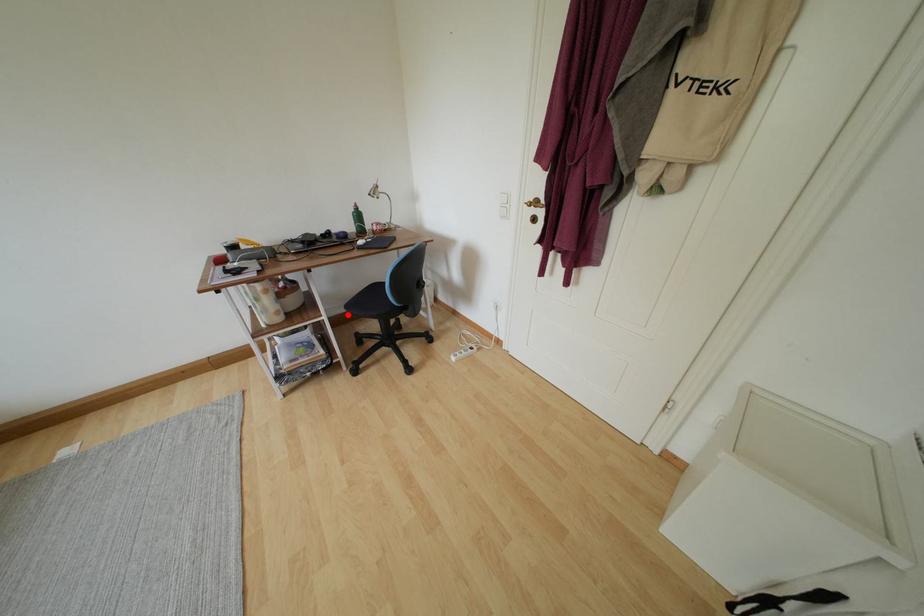
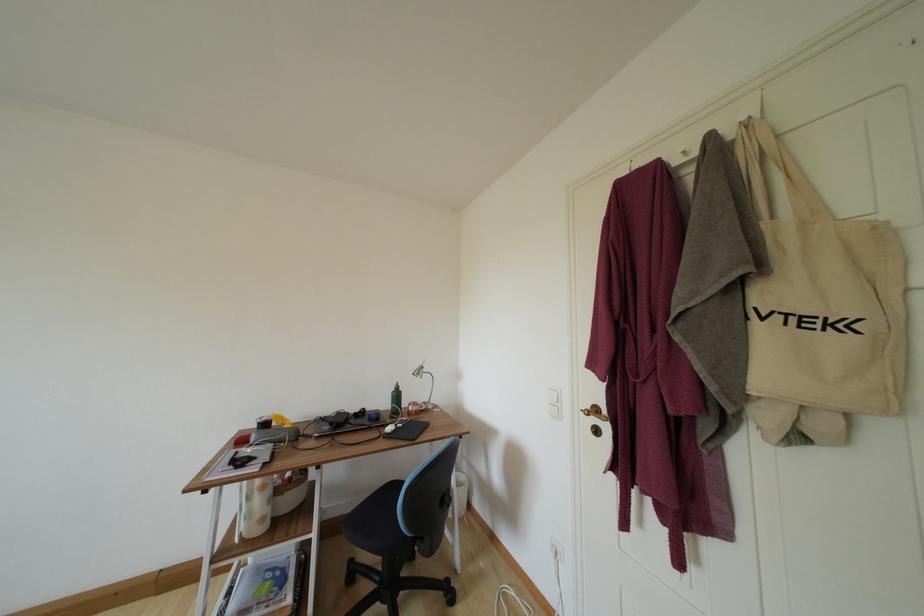
Locate, in the second image, the point that corresponds to the highlighted location in the first image.

(354, 514)